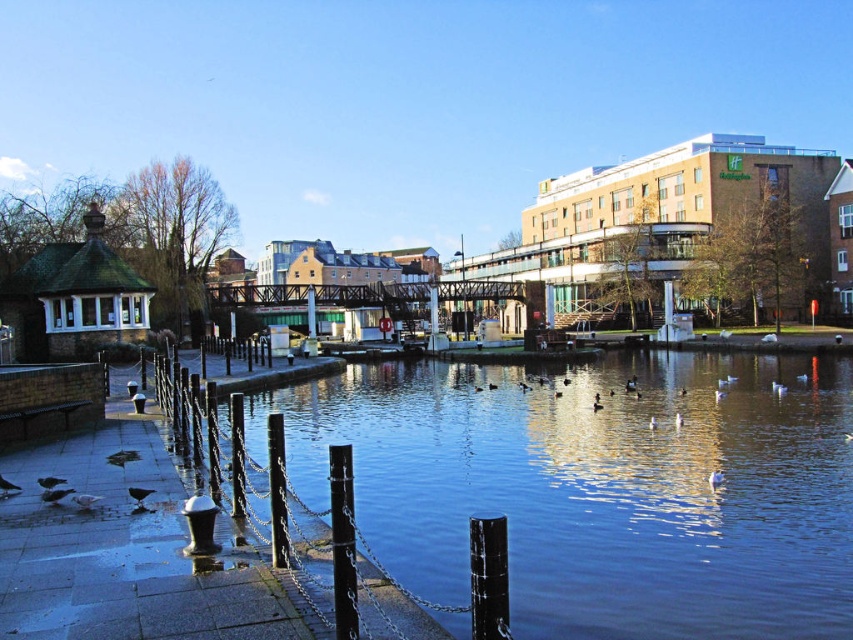
You are a painter standing on the walkway and want to paint the blue water at center and the black metal pole at lower center. Which object is wider in the image?

The blue water at center is wider than the black metal pole at lower center according to the description.

You are standing on the riverside walkway and want to take a photo of the blue water at center and the black metal pole at lower center. Which object will appear closer to the camera in the photo?

The blue water at center will appear closer to the camera in the photo because it is further to the viewer than the black metal pole at lower center.

You are a photographer trying to capture the blue water at center and the black metal pole at lower center in the same frame. Which object should you focus on first if you want to include both in your shot without moving the camera?

The blue water at center is bigger than the black metal pole at lower center, so you should focus on the blue water at center first to ensure it fills the frame adequately before adjusting for the smaller black metal pole at lower center.